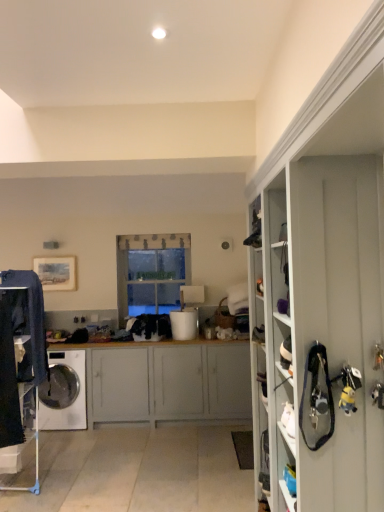
Image resolution: width=384 pixels, height=512 pixels. What do you see at coordinates (75, 400) in the screenshot?
I see `white glossy washing machine at lower left` at bounding box center [75, 400].

Locate an element on the screen. This screenshot has width=384, height=512. clear glass window at center is located at coordinates (151, 272).

Consider the image. Considering the relative positions of white glossy washing machine at lower left and clear glass window at center in the image provided, is white glossy washing machine at lower left to the left or to the right of clear glass window at center?

Based on their positions, white glossy washing machine at lower left is located to the left of clear glass window at center.

Considering the relative sizes of white glossy washing machine at lower left and clear glass window at center in the image provided, is white glossy washing machine at lower left bigger than clear glass window at center?

Indeed, white glossy washing machine at lower left has a larger size compared to clear glass window at center.

From a real-world perspective, is white glossy washing machine at lower left physically located above or below clear glass window at center?

Clearly, from a real-world perspective, white glossy washing machine at lower left is below clear glass window at center.

From the image's perspective, would you say white glossy washing machine at lower left is positioned over clear glass window at center?

No, from the image's perspective, white glossy washing machine at lower left is not on top of clear glass window at center.

Which of these two, clear glass window at center or white glossy washing machine at lower left, is bigger?

white glossy washing machine at lower left is bigger.

Based on the photo, which object is closer to the camera taking this photo, clear glass window at center or white glossy washing machine at lower left?

white glossy washing machine at lower left is in front.

Would you say clear glass window at center is a long distance from white glossy washing machine at lower left?

Absolutely, clear glass window at center is distant from white glossy washing machine at lower left.

Which point is more forward, (128, 283) or (79, 376)?

The point (79, 376) is more forward.

Considering the points (43, 318) and (164, 369), which point is in front, point (43, 318) or point (164, 369)?

Positioned in front is point (43, 318).

Is dark blue denim jeans at left in front of or behind white matte cabinet at center in the image?

dark blue denim jeans at left is positioned closer to the viewer than white matte cabinet at center.

Can we say dark blue denim jeans at left lies outside white matte cabinet at center?

Absolutely, dark blue denim jeans at left is external to white matte cabinet at center.

From the picture: Between dark blue denim jeans at left and white matte cabinet at center, which one has larger size?

white matte cabinet at center.

Identify the location of clothing on the right side of white glossy washing machine at lower left. The width and height of the screenshot is (384, 512). (13, 346).

Does dark blue denim jeans at left lie behind white glossy washing machine at lower left?

No, dark blue denim jeans at left is closer to the viewer.

Is dark blue denim jeans at left in contact with white glossy washing machine at lower left?

No, dark blue denim jeans at left is not making contact with white glossy washing machine at lower left.

How many degrees apart are the facing directions of dark blue denim jeans at left and white glossy washing machine at lower left?

They differ by 8.97 degrees in their facing directions.

Is white glossy washing machine at lower left taller or shorter than dark blue denim jeans at left?

white glossy washing machine at lower left is shorter than dark blue denim jeans at left.

How far apart are white glossy washing machine at lower left and dark blue denim jeans at left?

A distance of 3.80 feet exists between white glossy washing machine at lower left and dark blue denim jeans at left.

The image size is (384, 512). I want to click on clothing that appears in front of the white glossy washing machine at lower left, so click(x=13, y=346).

Looking at this image, who is bigger, white glossy washing machine at lower left or dark blue denim jeans at left?

Bigger between the two is white glossy washing machine at lower left.

Considering the sizes of objects white matte cabinet at center and white glossy washing machine at lower left in the image provided, who is thinner, white matte cabinet at center or white glossy washing machine at lower left?

white glossy washing machine at lower left is thinner.

What's the angular difference between white matte cabinet at center and white glossy washing machine at lower left's facing directions?

The angular difference between white matte cabinet at center and white glossy washing machine at lower left is 0.000304 degrees.

Is white glossy washing machine at lower left inside white matte cabinet at center?

Yes, white glossy washing machine at lower left is a part of white matte cabinet at center.

From a real-world perspective, is white matte cabinet at center positioned above or below white glossy washing machine at lower left?

white matte cabinet at center is above white glossy washing machine at lower left.

Could you tell me if white matte cabinet at center is turned towards dark blue denim jeans at left?

Yes, white matte cabinet at center is turned towards dark blue denim jeans at left.

Is white matte cabinet at center thinner than dark blue denim jeans at left?

No.

Is white matte cabinet at center smaller than dark blue denim jeans at left?

Actually, white matte cabinet at center might be larger than dark blue denim jeans at left.

Considering the sizes of white matte cabinet at center and dark blue denim jeans at left in the image, is white matte cabinet at center taller or shorter than dark blue denim jeans at left?

In the image, white matte cabinet at center appears to be shorter than dark blue denim jeans at left.

Identify the location of washing machine in front of the clear glass window at center. The height and width of the screenshot is (512, 384). (75, 400).

Identify the location of window behind the white glossy washing machine at lower left. (151, 272).

From the image, which object appears to be farther from white matte cabinet at center, clear glass window at center or dark blue denim jeans at left?

dark blue denim jeans at left is positioned further to the anchor white matte cabinet at center.

When comparing their distances from white matte cabinet at center, does dark blue denim jeans at left or white glossy washing machine at lower left seem closer?

white glossy washing machine at lower left is positioned closer to the anchor white matte cabinet at center.

When comparing their distances from clear glass window at center, does white glossy washing machine at lower left or dark blue denim jeans at left seem further?

dark blue denim jeans at left lies further to clear glass window at center than the other object.

In the scene shown: Which object lies further to the anchor point dark blue denim jeans at left, white matte cabinet at center or clear glass window at center?

The object further to dark blue denim jeans at left is clear glass window at center.

Considering their positions, is white glossy washing machine at lower left positioned closer to white matte cabinet at center than dark blue denim jeans at left?

white glossy washing machine at lower left.

From the image, which object appears to be farther from clear glass window at center, white matte cabinet at center or white glossy washing machine at lower left?

white glossy washing machine at lower left lies further to clear glass window at center than the other object.

Considering their positions, is dark blue denim jeans at left positioned further to clear glass window at center than white matte cabinet at center?

Among the two, dark blue denim jeans at left is located further to clear glass window at center.

Looking at the image, which one is located closer to white glossy washing machine at lower left, clear glass window at center or white matte cabinet at center?

white matte cabinet at center lies closer to white glossy washing machine at lower left than the other object.

Image resolution: width=384 pixels, height=512 pixels. In order to click on cabinetry positioned between dark blue denim jeans at left and white glossy washing machine at lower left from near to far in this screenshot , I will do `click(171, 383)`.

You are a GUI agent. You are given a task and a screenshot of the screen. Output one action in this format:
    pyautogui.click(x=<x>, y=<y>)
    Task: Click on the washing machine between dark blue denim jeans at left and clear glass window at center along the z-axis
    This screenshot has width=384, height=512.
    Given the screenshot: What is the action you would take?
    pyautogui.click(x=75, y=400)

Where is `cabinetry between dark blue denim jeans at left and clear glass window at center along the z-axis`? The image size is (384, 512). cabinetry between dark blue denim jeans at left and clear glass window at center along the z-axis is located at coordinates (171, 383).

Locate an element on the screen. cabinetry that lies between clear glass window at center and white glossy washing machine at lower left from top to bottom is located at coordinates (171, 383).